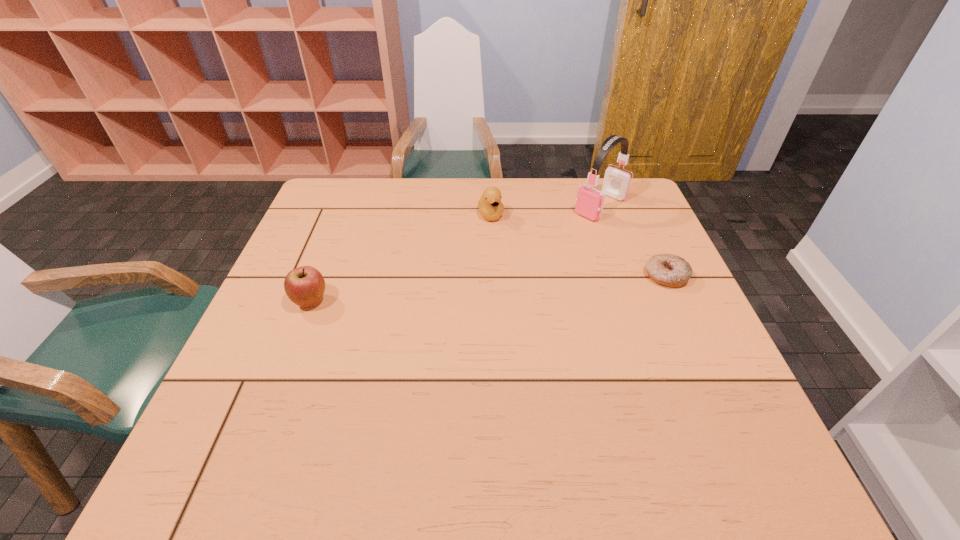
Locate an element on the screen. The width and height of the screenshot is (960, 540). vacant region that satisfies the following two spatial constraints: 1. on the back side of the apple; 2. on the right side of the earphone is located at coordinates (348, 206).